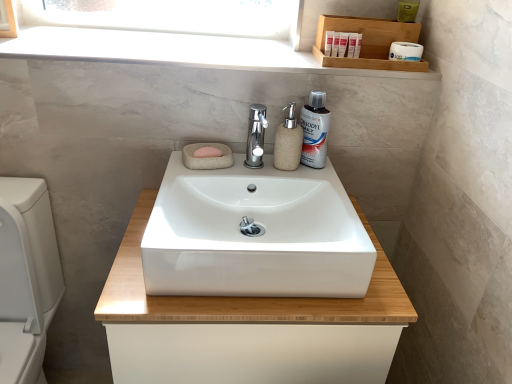
Question: Would you say white glossy sink at center is to the left or to the right of polished chrome tap at center in the picture?

Choices:
 (A) right
 (B) left

Answer: (B)

Question: From a real-world perspective, is white glossy sink at center above or below polished chrome tap at center?

Choices:
 (A) below
 (B) above

Answer: (A)

Question: Considering the real-world distances, which object is farthest from the white plastic tubes at upper right, which is the second toiletry from left to right?

Choices:
 (A) white glossy toilet at lower left
 (B) wooden tray at upper right
 (C) white plastic tubes at upper center, the first toiletry positioned from the left
 (D) white plastic tubes at upper right, which is counted as the third toiletry, starting from the left
 (E) polished chrome tap at center

Answer: (A)

Question: Estimate the real-world distances between objects in this image. Which object is closer to the beige stone soap dispenser at center?

Choices:
 (A) white glossy toilet at lower left
 (B) white plastic tubes at upper right, which is counted as the third toiletry, starting from the left
 (C) white glossy sink at center
 (D) polished chrome tap at center
 (E) white matte toilet paper at upper right

Answer: (D)